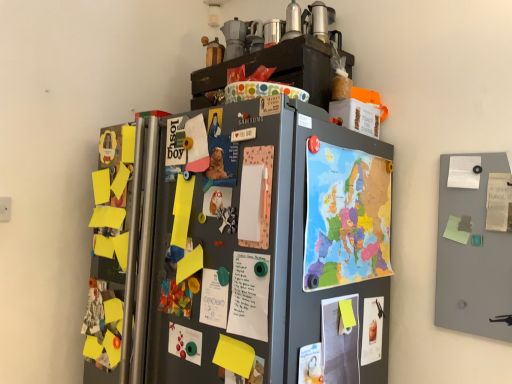
Locate an element on the screen. This screenshot has width=512, height=384. colorful paper map at right is located at coordinates (346, 216).

You are a GUI agent. You are given a task and a screenshot of the screen. Output one action in this format:
    pyautogui.click(x=<x>, y=<y>)
    Task: Click on the matte paper poster at center, acting as the 2th poster starting from the left
    The image size is (512, 384).
    Given the screenshot: What is the action you would take?
    pyautogui.click(x=214, y=298)

In order to face matte paper poster at lower left, which is the sixth poster from right to left, should I rotate leftwards or rightwards?

Rotate your view left by about 9.781°.

The width and height of the screenshot is (512, 384). Identify the location of matte paper poster at right, the first poster when ordered from right to left. (499, 202).

Considering the relative positions of matte paper poster at lower left, which is the sixth poster from right to left, and white paper at center, the 3th poster when ordered from left to right, in the image provided, is matte paper poster at lower left, which is the sixth poster from right to left, behind white paper at center, the 3th poster when ordered from left to right,?

Yes, the depth of matte paper poster at lower left, which is the sixth poster from right to left, is greater than that of white paper at center, the 3th poster when ordered from left to right.

Can we say matte paper poster at lower left, marked as the 1th poster in a left-to-right arrangement, lies outside white paper at center, positioned as the fourth poster in right-to-left order?

Yes, matte paper poster at lower left, marked as the 1th poster in a left-to-right arrangement, is not within white paper at center, positioned as the fourth poster in right-to-left order.

From the image's perspective, is matte paper poster at lower left, marked as the 1th poster in a left-to-right arrangement, below white paper at center, positioned as the fourth poster in right-to-left order?

Indeed, from the image's perspective, matte paper poster at lower left, marked as the 1th poster in a left-to-right arrangement, is shown beneath white paper at center, positioned as the fourth poster in right-to-left order.

Does matte paper poster at lower left, which is the sixth poster from right to left, have a lesser height compared to white paper at center, the 3th poster when ordered from left to right?

Yes.

From the picture: From a real-world perspective, relative to matte white poster at lower center, which is the third poster from right to left, is metallic silver canisters at upper center, which is counted as the second appliance, starting from the back, vertically above or below?

metallic silver canisters at upper center, which is counted as the second appliance, starting from the back, is situated higher than matte white poster at lower center, which is the third poster from right to left, in the real world.

In the scene shown: From the image's perspective, is metallic silver canisters at upper center, the first appliance in the front-to-back sequence, on top of matte white poster at lower center, placed as the 4th poster when sorted from left to right?

Yes.

Could you tell me if metallic silver canisters at upper center, the 1th appliance from the left, is facing matte white poster at lower center, placed as the 4th poster when sorted from left to right?

No, metallic silver canisters at upper center, the 1th appliance from the left, is not oriented towards matte white poster at lower center, placed as the 4th poster when sorted from left to right.

In the scene shown: Between metallic silver canisters at upper center, marked as the 2th appliance in a right-to-left arrangement, and matte white poster at lower center, which is the third poster from right to left, which one has less height?

metallic silver canisters at upper center, marked as the 2th appliance in a right-to-left arrangement, is shorter.

Would you say matte paper poster at lower left, which is the sixth poster from right to left, is inside or outside matte paper poster at center, acting as the 2th poster starting from the left?

matte paper poster at lower left, which is the sixth poster from right to left, lies outside matte paper poster at center, acting as the 2th poster starting from the left.

Does matte paper poster at lower left, marked as the 1th poster in a left-to-right arrangement, touch matte paper poster at center, the 5th poster in the right-to-left sequence?

No, matte paper poster at lower left, marked as the 1th poster in a left-to-right arrangement, is not next to matte paper poster at center, the 5th poster in the right-to-left sequence.

Is matte paper poster at lower left, marked as the 1th poster in a left-to-right arrangement, aimed at matte paper poster at center, acting as the 2th poster starting from the left?

No.

You are a GUI agent. You are given a task and a screenshot of the screen. Output one action in this format:
    pyautogui.click(x=<x>, y=<y>)
    Task: Click on the poster that is the 1st one when counting upward from the matte paper poster at lower left, which is the sixth poster from right to left (from the image's perspective)
    The image size is (512, 384).
    Given the screenshot: What is the action you would take?
    pyautogui.click(x=214, y=298)

Which point is more forward, (x=379, y=233) or (x=201, y=339)?

The point (x=201, y=339) is more forward.

Is colorful paper map at right surrounding matte paper poster at lower left, which is the sixth poster from right to left?

That's incorrect, matte paper poster at lower left, which is the sixth poster from right to left, is not inside colorful paper map at right.

From the image's perspective, between colorful paper map at right and matte paper poster at lower left, marked as the 1th poster in a left-to-right arrangement, which one is located above?

From the image's view, colorful paper map at right is above.

Where is `poster that is the 1st object directly below the white paper at center, the 3th poster when ordered from left to right (from a real-world perspective)`? Image resolution: width=512 pixels, height=384 pixels. poster that is the 1st object directly below the white paper at center, the 3th poster when ordered from left to right (from a real-world perspective) is located at coordinates (214, 298).

Considering the sizes of objects white paper at center, positioned as the fourth poster in right-to-left order, and matte paper poster at center, acting as the 2th poster starting from the left, in the image provided, who is thinner, white paper at center, positioned as the fourth poster in right-to-left order, or matte paper poster at center, acting as the 2th poster starting from the left,?

Thinner between the two is white paper at center, positioned as the fourth poster in right-to-left order.

Which object is closer to the camera, white paper at center, positioned as the fourth poster in right-to-left order, or matte paper poster at center, the 5th poster in the right-to-left sequence?

white paper at center, positioned as the fourth poster in right-to-left order, is closer to the camera.

How many degrees apart are the facing directions of white paper at center, the 3th poster when ordered from left to right, and matte paper poster at center, acting as the 2th poster starting from the left?

0.00192 degrees separate the facing orientations of white paper at center, the 3th poster when ordered from left to right, and matte paper poster at center, acting as the 2th poster starting from the left.

Is point (170, 340) farther from camera compared to point (490, 180)?

No, it is not.

Between matte paper poster at lower left, which is the sixth poster from right to left, and matte paper poster at right, the first poster when ordered from right to left, which one is positioned in front?

Positioned in front is matte paper poster at lower left, which is the sixth poster from right to left.

Between matte paper poster at lower left, marked as the 1th poster in a left-to-right arrangement, and matte paper poster at right, the first poster when ordered from right to left, which one has smaller width?

matte paper poster at lower left, marked as the 1th poster in a left-to-right arrangement.

How different are the orientations of matte white poster at lower center, which is the third poster from right to left, and colorful paper map at right in degrees?

There is a 3.69-degree angle between the facing directions of matte white poster at lower center, which is the third poster from right to left, and colorful paper map at right.

Is point (318, 374) farther from viewer compared to point (326, 235)?

No, (318, 374) is in front of (326, 235).

Between matte white poster at lower center, which is the third poster from right to left, and colorful paper map at right, which one appears on the left side from the viewer's perspective?

matte white poster at lower center, which is the third poster from right to left, is more to the left.

Find the location of a particular element. The height and width of the screenshot is (384, 512). the 2nd poster positioned below the white paper at center, the 3th poster when ordered from left to right (from the image's perspective) is located at coordinates (185, 343).

Where is `poster that is the 5th object located in front of the metallic silver canisters at upper center, which is counted as the second appliance, starting from the back`? Image resolution: width=512 pixels, height=384 pixels. poster that is the 5th object located in front of the metallic silver canisters at upper center, which is counted as the second appliance, starting from the back is located at coordinates (310, 364).

Looking at the image, which one is located further to metallic silver coffee pot at upper center, which is counted as the first appliance, starting from the right, colorful paper map at right or matte paper poster at center, the 5th poster in the right-to-left sequence?

matte paper poster at center, the 5th poster in the right-to-left sequence, is further to metallic silver coffee pot at upper center, which is counted as the first appliance, starting from the right.

Looking at this image, estimate the real-world distances between objects in this image. Which object is further from matte paper poster at lower right, the fifth poster when ordered from left to right, matte paper poster at right, positioned as the sixth poster in left-to-right order, or smooth gray board at right?

matte paper poster at right, positioned as the sixth poster in left-to-right order, is further to matte paper poster at lower right, the fifth poster when ordered from left to right.

Looking at the image, which one is located further to matte paper poster at right, the first poster when ordered from right to left, metallic silver canisters at upper center, which is counted as the second appliance, starting from the back, or smooth gray board at right?

Among the two, metallic silver canisters at upper center, which is counted as the second appliance, starting from the back, is located further to matte paper poster at right, the first poster when ordered from right to left.

Based on their spatial positions, is metallic silver coffee pot at upper center, which ranks as the 1th appliance in back-to-front order, or matte paper poster at right, the first poster when ordered from right to left, closer to smooth gray board at right?

matte paper poster at right, the first poster when ordered from right to left.

Looking at the image, which one is located further to matte paper poster at right, the first poster when ordered from right to left, matte paper poster at lower left, which is the sixth poster from right to left, or matte paper poster at center, the 5th poster in the right-to-left sequence?

matte paper poster at lower left, which is the sixth poster from right to left, is positioned further to the anchor matte paper poster at right, the first poster when ordered from right to left.

Based on their spatial positions, is matte paper poster at right, the first poster when ordered from right to left, or white paper at center, the 3th poster when ordered from left to right, closer to metallic silver canisters at upper center, the first appliance in the front-to-back sequence?

matte paper poster at right, the first poster when ordered from right to left.

From the image, which object appears to be nearer to matte paper poster at lower right, the fifth poster when ordered from left to right, metallic silver canisters at upper center, the 1th appliance from the left, or white paper at center, positioned as the fourth poster in right-to-left order?

white paper at center, positioned as the fourth poster in right-to-left order, is positioned closer to the anchor matte paper poster at lower right, the fifth poster when ordered from left to right.

Estimate the real-world distances between objects in this image. Which object is further from colorful paper map at right, matte white poster at lower center, placed as the 4th poster when sorted from left to right, or white paper at center, the 3th poster when ordered from left to right?

matte white poster at lower center, placed as the 4th poster when sorted from left to right, is positioned further to the anchor colorful paper map at right.

Locate an element on the screen. This screenshot has height=384, width=512. map that lies between metallic silver canisters at upper center, which is counted as the second appliance, starting from the back, and white paper at center, positioned as the fourth poster in right-to-left order, from top to bottom is located at coordinates (346, 216).

You are a GUI agent. You are given a task and a screenshot of the screen. Output one action in this format:
    pyautogui.click(x=<x>, y=<y>)
    Task: Click on the map situated between matte paper poster at lower left, marked as the 1th poster in a left-to-right arrangement, and matte paper poster at right, the first poster when ordered from right to left, from left to right
    This screenshot has height=384, width=512.
    Given the screenshot: What is the action you would take?
    pyautogui.click(x=346, y=216)

The image size is (512, 384). Find the location of `poster between metallic silver coffee pot at upper center, which is counted as the first appliance, starting from the right, and colorful paper map at right vertically`. poster between metallic silver coffee pot at upper center, which is counted as the first appliance, starting from the right, and colorful paper map at right vertically is located at coordinates (499, 202).

Find the location of a particular element. This screenshot has width=512, height=384. poster situated between matte white poster at lower center, which is the third poster from right to left, and smooth gray board at right from left to right is located at coordinates (372, 330).